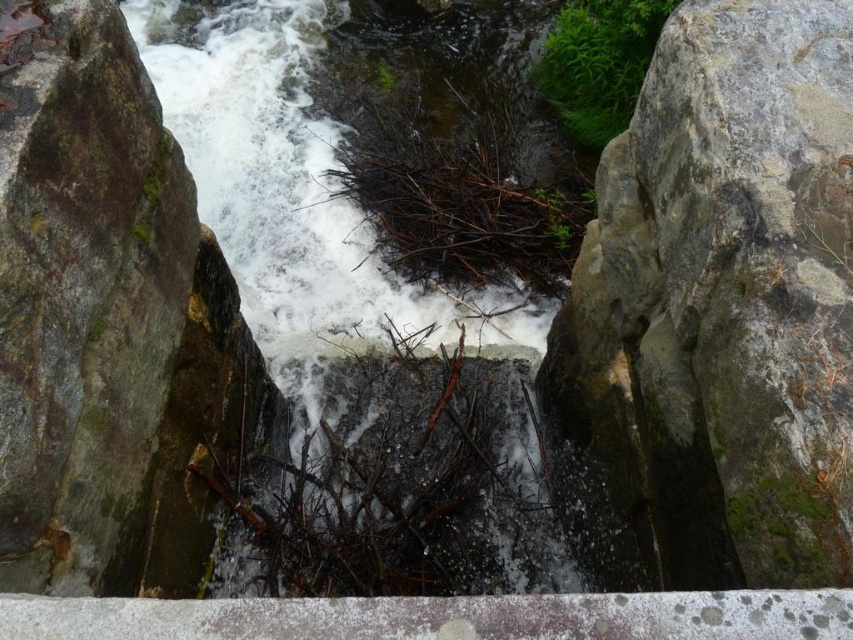
Question: Which of these objects is positioned closest to the brown woody twig at center?

Choices:
 (A) white frothy water at center
 (B) gray rough rock at center
 (C) green mossy rock at left

Answer: (A)

Question: Which point is closer to the camera?

Choices:
 (A) white frothy water at center
 (B) green mossy rock at left
 (C) gray rough rock at center
 (D) brown woody twig at center

Answer: (C)

Question: Which point is farther from the camera taking this photo?

Choices:
 (A) (169, 48)
 (B) (699, 45)

Answer: (A)

Question: Is white frothy water at center in front of brown woody twig at center?

Choices:
 (A) no
 (B) yes

Answer: (A)

Question: Is the position of gray rough rock at center more distant than that of brown woody twig at center?

Choices:
 (A) yes
 (B) no

Answer: (B)

Question: Can you confirm if gray rough rock at center is positioned above white frothy water at center?

Choices:
 (A) no
 (B) yes

Answer: (A)